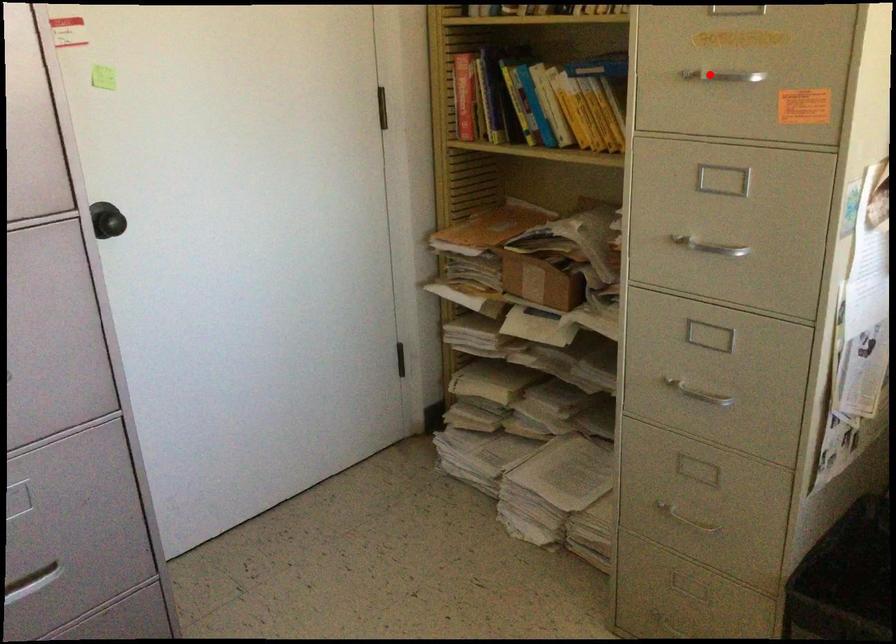
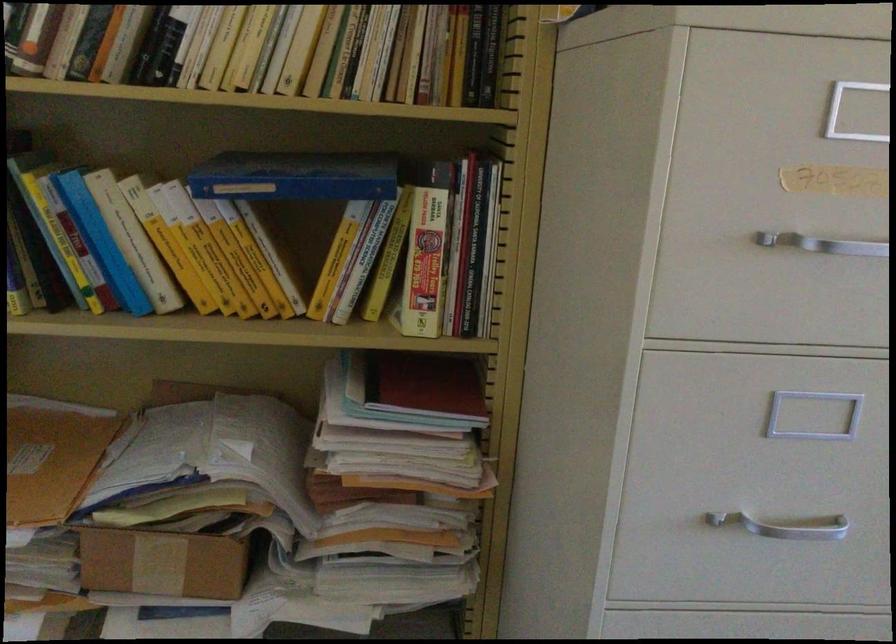
Where in the second image is the point corresponding to the highlighted location from the first image?

(823, 243)